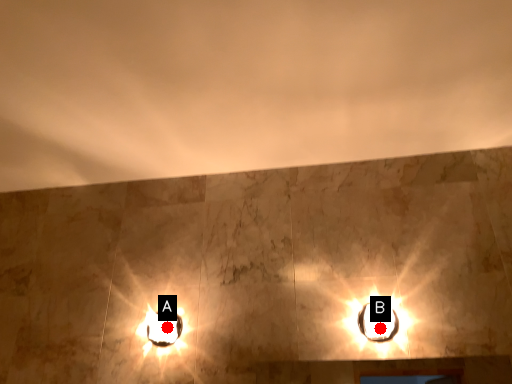
Question: Two points are circled on the image, labeled by A and B beside each circle. Which point is closer to the camera?

Choices:
 (A) A is closer
 (B) B is closer

Answer: (B)